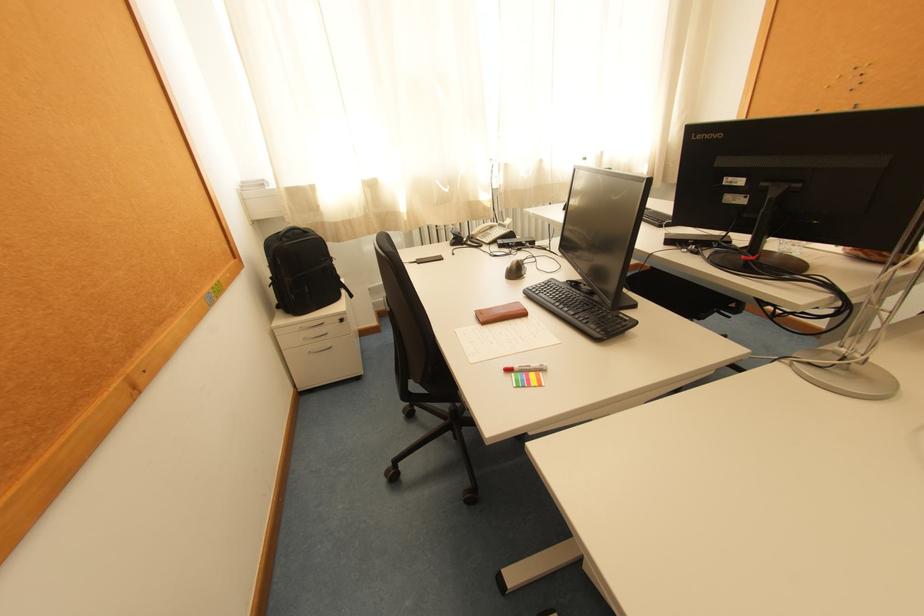
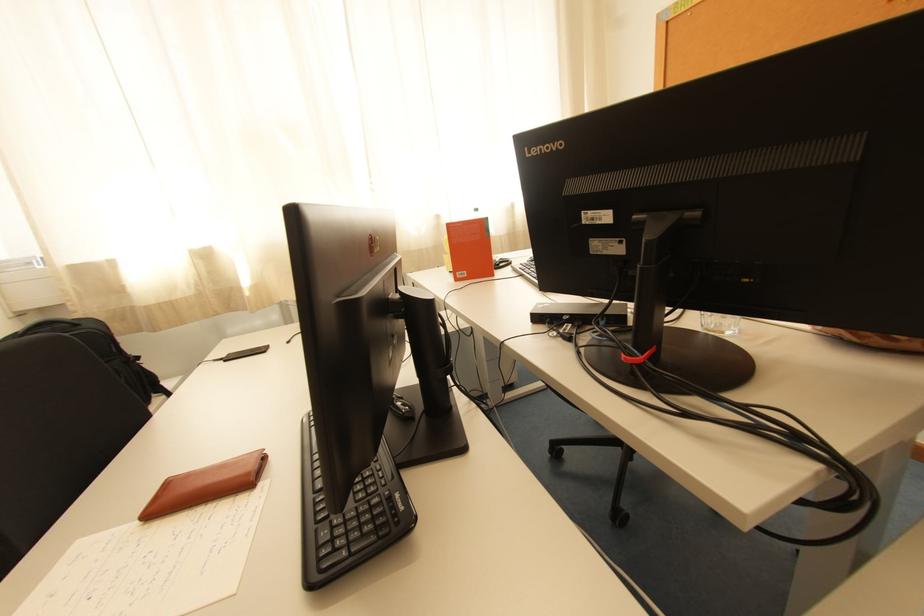
From the picture: In a continuous first-person perspective shot, in which direction is the camera moving?

The cameraman walked toward right, forward.